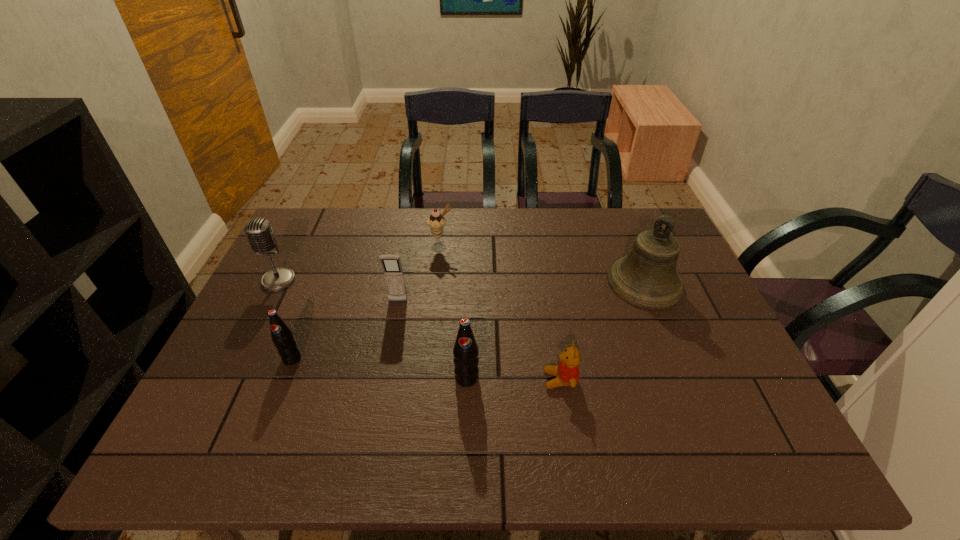
At what (x,y) coordinates should I click in order to perform the action: click on the left pop. Please return your answer as a coordinate pair (x, y). Looking at the image, I should click on (282, 336).

The height and width of the screenshot is (540, 960). I want to click on the shorter pop, so click(282, 336).

At what (x,y) coordinates should I click in order to perform the action: click on the right pop. Please return your answer as a coordinate pair (x, y). Image resolution: width=960 pixels, height=540 pixels. Looking at the image, I should click on (465, 351).

Identify the location of the nearer pop. This screenshot has width=960, height=540. (465, 351).

Where is `icecream`? The height and width of the screenshot is (540, 960). icecream is located at coordinates (436, 222).

Identify the location of the farthest object. (436, 222).

Find the location of a particular element. The height and width of the screenshot is (540, 960). the rightmost object is located at coordinates (647, 277).

Locate an element on the screen. the fifth object from right to left is located at coordinates (393, 272).

What are the coordinates of `the leftmost object` in the screenshot? It's located at (259, 232).

I want to click on the sixth object from left to right, so click(x=567, y=372).